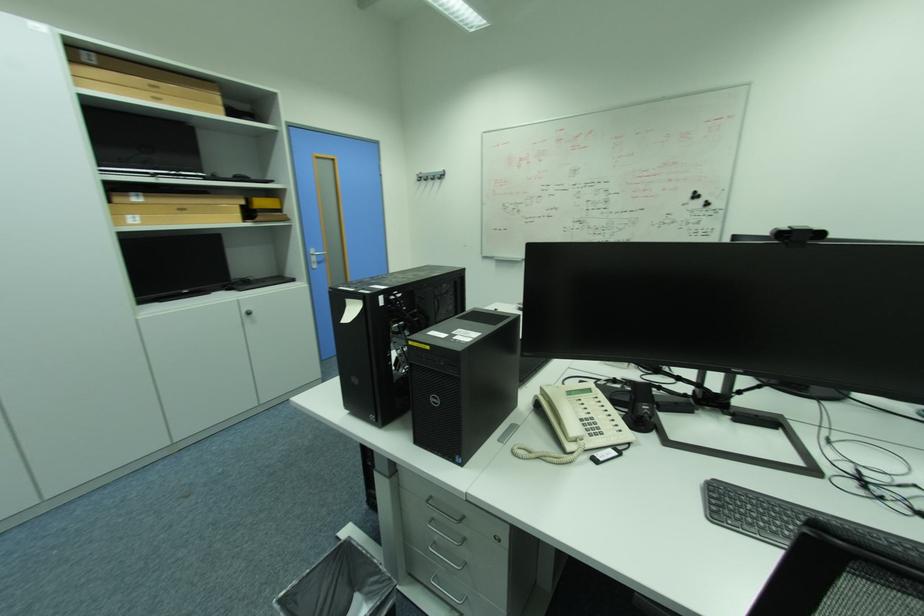
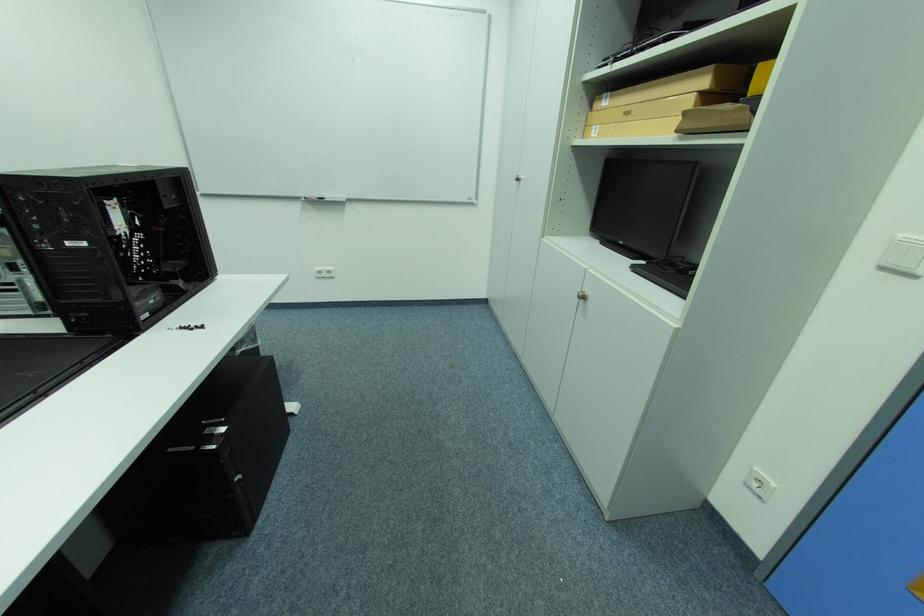
Locate, in the second image, the point that corresponds to [143,197] in the first image.

(614, 98)